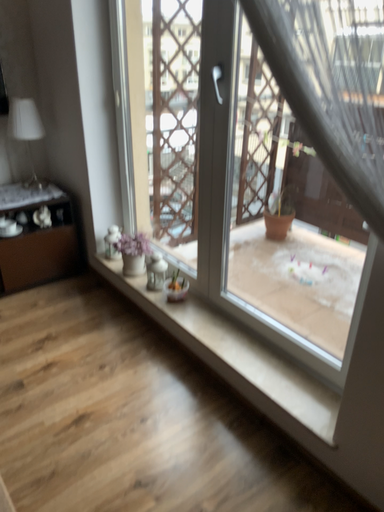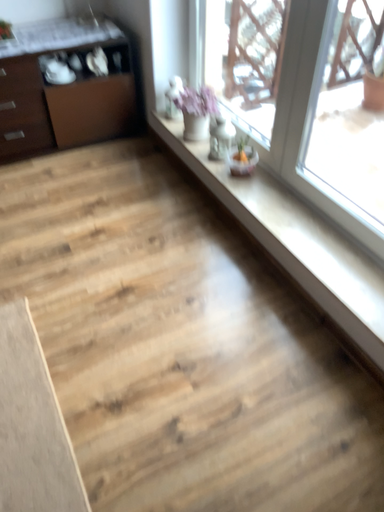
Question: Which way did the camera rotate in the video?

Choices:
 (A) rotated right
 (B) rotated left

Answer: (B)